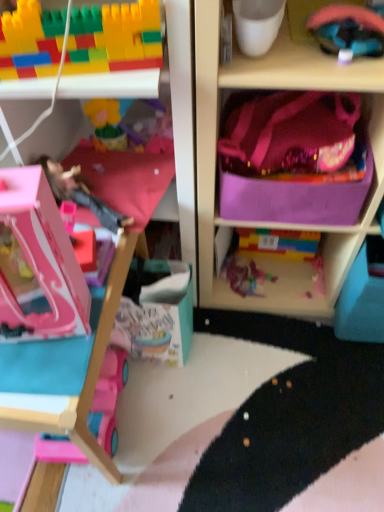
You are a GUI agent. You are given a task and a screenshot of the screen. Output one action in this format:
    pyautogui.click(x=<x>, y=<y>)
    Task: Click on the vacant space in front of purple fabric bag at upper right
    The height and width of the screenshot is (512, 384).
    Given the screenshot: What is the action you would take?
    pyautogui.click(x=280, y=398)